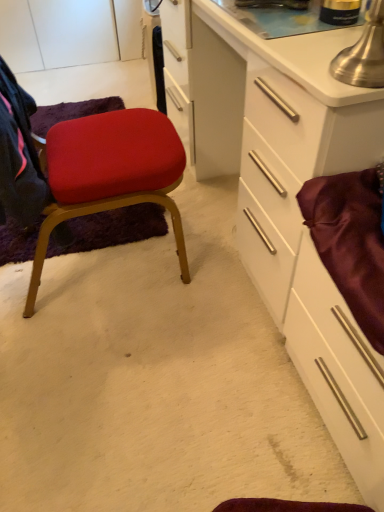
The image size is (384, 512). I want to click on metallic silver table lamp at upper right, so click(364, 54).

The width and height of the screenshot is (384, 512). I want to click on matte fabric chair at left, so click(110, 174).

The width and height of the screenshot is (384, 512). I want to click on white glossy cabinet at center, so click(x=305, y=226).

Find the location of a particular element. metallic silver table lamp at upper right is located at coordinates (364, 54).

Is point (338, 295) more distant than point (323, 366)?

No.

Is white glossy cabinet at center closer to camera compared to satin burgundy drawer at right?

No, it is not.

Can you confirm if white glossy cabinet at center is bigger than satin burgundy drawer at right?

Correct, white glossy cabinet at center is larger in size than satin burgundy drawer at right.

From the image's perspective, between metallic silver table lamp at upper right and white glossy cabinet at center, who is located below?

metallic silver table lamp at upper right.

Considering the relative positions of metallic silver table lamp at upper right and white glossy cabinet at center in the image provided, is metallic silver table lamp at upper right to the right of white glossy cabinet at center from the viewer's perspective?

Indeed, metallic silver table lamp at upper right is positioned on the right side of white glossy cabinet at center.

From a real-world perspective, is metallic silver table lamp at upper right positioned under white glossy cabinet at center based on gravity?

No.

Considering the positions of objects metallic silver table lamp at upper right and white glossy cabinet at center in the image provided, who is in front, metallic silver table lamp at upper right or white glossy cabinet at center?

metallic silver table lamp at upper right is in front.

How different are the orientations of satin burgundy drawer at right and matte fabric chair at left in degrees?

178 degrees separate the facing orientations of satin burgundy drawer at right and matte fabric chair at left.

Considering the points (345, 429) and (169, 184), which point is behind, point (345, 429) or point (169, 184)?

Positioned behind is point (169, 184).

Does satin burgundy drawer at right have a greater width compared to matte fabric chair at left?

Incorrect, the width of satin burgundy drawer at right does not surpass that of matte fabric chair at left.

Considering the positions of objects satin burgundy drawer at right and matte fabric chair at left in the image provided, who is more to the left, satin burgundy drawer at right or matte fabric chair at left?

From the viewer's perspective, matte fabric chair at left appears more on the left side.

Is matte fabric chair at left at the back of metallic silver table lamp at upper right?

metallic silver table lamp at upper right is not turned away from matte fabric chair at left.

Which is correct: metallic silver table lamp at upper right is inside matte fabric chair at left, or outside of it?

metallic silver table lamp at upper right exists outside the volume of matte fabric chair at left.

Is there a large distance between metallic silver table lamp at upper right and matte fabric chair at left?

No, metallic silver table lamp at upper right is not far away from matte fabric chair at left.

Looking at this image, considering the relative positions of metallic silver table lamp at upper right and matte fabric chair at left in the image provided, is metallic silver table lamp at upper right in front of matte fabric chair at left?

Yes, metallic silver table lamp at upper right is closer to the camera.

Does white glossy cabinet at center have a larger size compared to metallic silver table lamp at upper right?

Yes.

From the image's perspective, is white glossy cabinet at center over metallic silver table lamp at upper right?

Yes, from the image's perspective, white glossy cabinet at center is over metallic silver table lamp at upper right.

In terms of height, does white glossy cabinet at center look taller or shorter compared to metallic silver table lamp at upper right?

In the image, white glossy cabinet at center appears to be taller than metallic silver table lamp at upper right.

From a real-world perspective, which object rests below the other?

white glossy cabinet at center is physically lower.

Looking at this image, from the image's perspective, between matte fabric chair at left and metallic silver table lamp at upper right, who is located below?

matte fabric chair at left appears lower in the image.

Does point (171, 182) appear closer or farther from the camera than point (352, 68)?

Point (171, 182) is positioned farther from the camera compared to point (352, 68).

Considering the relative sizes of matte fabric chair at left and metallic silver table lamp at upper right in the image provided, is matte fabric chair at left smaller than metallic silver table lamp at upper right?

Incorrect, matte fabric chair at left is not smaller in size than metallic silver table lamp at upper right.

Where is `table lamp above the matte fabric chair at left (from a real-world perspective)`? table lamp above the matte fabric chair at left (from a real-world perspective) is located at coordinates (364, 54).

Is satin burgundy drawer at right facing towards metallic silver table lamp at upper right?

No, satin burgundy drawer at right is not facing towards metallic silver table lamp at upper right.

Considering the positions of objects satin burgundy drawer at right and metallic silver table lamp at upper right in the image provided, who is more to the right, satin burgundy drawer at right or metallic silver table lamp at upper right?

Positioned to the right is satin burgundy drawer at right.

Looking at this image, is satin burgundy drawer at right inside or outside of metallic silver table lamp at upper right?

satin burgundy drawer at right cannot be found inside metallic silver table lamp at upper right.

Which point is more forward, (341, 432) or (373, 85)?

The point (373, 85) is more forward.

Locate an element on the screen. This screenshot has height=512, width=384. cabinetry above the satin burgundy drawer at right (from the image's perspective) is located at coordinates (305, 226).

Locate an element on the screen. This screenshot has width=384, height=512. table lamp in front of the white glossy cabinet at center is located at coordinates (364, 54).

Consider the image. From the image, which object appears to be farther from white glossy cabinet at center, metallic silver table lamp at upper right or satin burgundy drawer at right?

metallic silver table lamp at upper right lies further to white glossy cabinet at center than the other object.

Estimate the real-world distances between objects in this image. Which object is further from satin burgundy drawer at right, metallic silver table lamp at upper right or matte fabric chair at left?

matte fabric chair at left.

Looking at the image, which one is located further to satin burgundy drawer at right, matte fabric chair at left or metallic silver table lamp at upper right?

matte fabric chair at left is positioned further to the anchor satin burgundy drawer at right.

Based on their spatial positions, is matte fabric chair at left or metallic silver table lamp at upper right further from white glossy cabinet at center?

matte fabric chair at left is further to white glossy cabinet at center.

Based on their spatial positions, is satin burgundy drawer at right or white glossy cabinet at center closer to matte fabric chair at left?

Among the two, white glossy cabinet at center is located nearer to matte fabric chair at left.

Considering their positions, is satin burgundy drawer at right positioned further to matte fabric chair at left than metallic silver table lamp at upper right?

metallic silver table lamp at upper right lies further to matte fabric chair at left than the other object.

Based on their spatial positions, is white glossy cabinet at center or satin burgundy drawer at right further from metallic silver table lamp at upper right?

satin burgundy drawer at right lies further to metallic silver table lamp at upper right than the other object.

Looking at the image, which one is located further to matte fabric chair at left, metallic silver table lamp at upper right or satin burgundy drawer at right?

metallic silver table lamp at upper right.

Find the location of a particular element. This screenshot has height=512, width=384. cabinetry located between matte fabric chair at left and satin burgundy drawer at right in the left-right direction is located at coordinates (305, 226).

Identify the location of cabinetry between matte fabric chair at left and metallic silver table lamp at upper right from left to right. (305, 226).

The width and height of the screenshot is (384, 512). Identify the location of table lamp between matte fabric chair at left and satin burgundy drawer at right from left to right. (364, 54).

The height and width of the screenshot is (512, 384). Find the location of `table lamp between white glossy cabinet at center and satin burgundy drawer at right vertically`. table lamp between white glossy cabinet at center and satin burgundy drawer at right vertically is located at coordinates (364, 54).